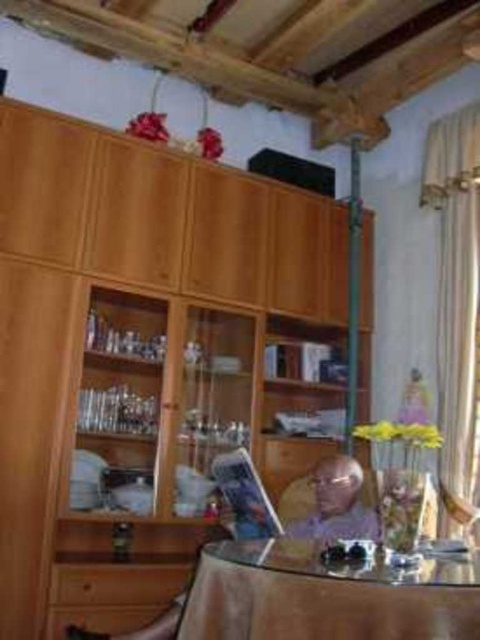
Can you confirm if transparent glass table at center is smaller than light purple fabric at center?

Incorrect, transparent glass table at center is not smaller in size than light purple fabric at center.

Who is taller, transparent glass table at center or light purple fabric at center?

light purple fabric at center is taller.

Who is more distant from viewer, (x=238, y=621) or (x=345, y=532)?

Point (x=345, y=532)

Locate an element on the screen. transparent glass table at center is located at coordinates (326, 596).